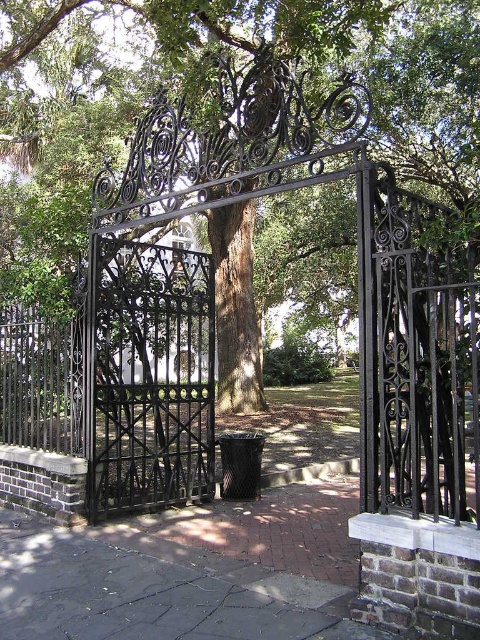
Is green leafy tree at center to the right of black wrought iron gate at center from the viewer's perspective?

Incorrect, green leafy tree at center is not on the right side of black wrought iron gate at center.

Does green leafy tree at center have a larger size compared to black wrought iron gate at center?

Correct, green leafy tree at center is larger in size than black wrought iron gate at center.

You are a GUI agent. You are given a task and a screenshot of the screen. Output one action in this format:
    pyautogui.click(x=<x>, y=<y>)
    Task: Click on the green leafy tree at center
    
    Given the screenshot: What is the action you would take?
    pyautogui.click(x=324, y=60)